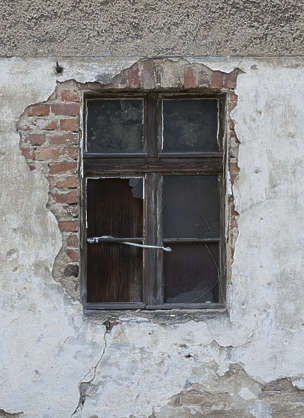
Image resolution: width=304 pixels, height=418 pixels. What are the coordinates of `wooden board` in the screenshot? It's located at (150, 198).